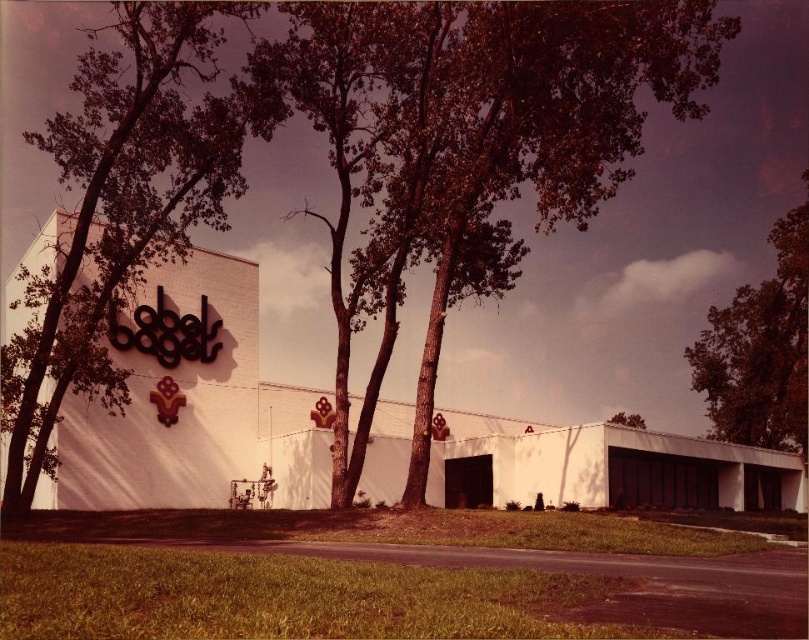
You are standing in front of the Gabel Bagels building and want to take a photo that includes both the building and the green leafy tree at upper left. Based on their positions, where should you position yourself to ensure both are in the frame?

Since the green leafy tree at upper left is located at point (121,204), you should position yourself to the lower right of the building to include both the building and the tree in your photo.

You are a drone operator who needs to fly a drone from the green leafy tree at upper left to the green leafy tree at upper center. Given that your drone has a maximum range of 40 meters, can it make the trip without needing to recharge?

Result: The distance between the green leafy tree at upper left and the green leafy tree at upper center is 44.03 meters. Since the drone can only travel 40 meters before needing to recharge, it cannot make the trip without recharging.